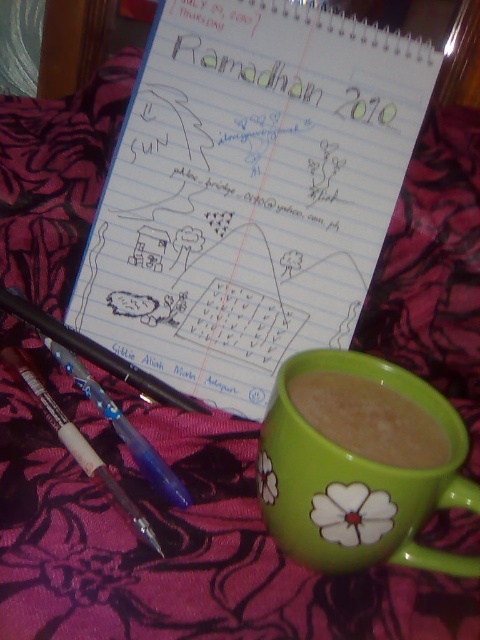
How much distance is there between green ceramic mug at center and white plastic pen at lower left?

They are 6.38 inches apart.

Which is in front, point (346, 461) or point (120, 497)?

Point (346, 461)

Identify the location of green ceramic mug at center. Image resolution: width=480 pixels, height=640 pixels. (356, 480).

Is green ceramic mug at center to the right of green matte mug at lower right from the viewer's perspective?

Indeed, green ceramic mug at center is positioned on the right side of green matte mug at lower right.

Which is below, green ceramic mug at center or green matte mug at lower right?

green ceramic mug at center is lower down.

Where is `green ceramic mug at center`? The image size is (480, 640). green ceramic mug at center is located at coordinates (356, 480).

This screenshot has width=480, height=640. I want to click on green ceramic mug at center, so click(356, 480).

Does white lined paper at center appear on the right side of green ceramic mug at center?

In fact, white lined paper at center is to the left of green ceramic mug at center.

Locate an element on the screen. This screenshot has height=640, width=480. white lined paper at center is located at coordinates (249, 193).